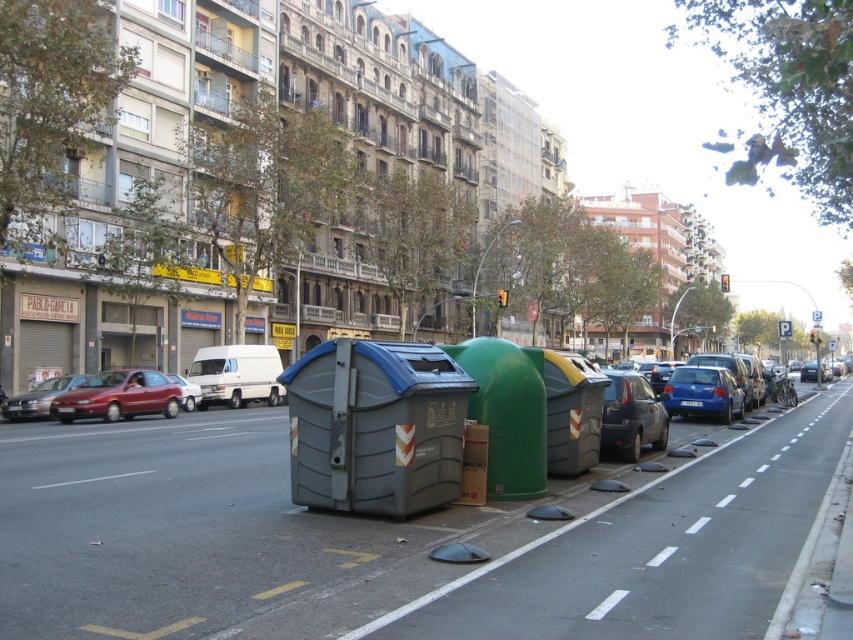
Question: Is white dashed lines at lower right wider than metallic red car at left?

Choices:
 (A) no
 (B) yes

Answer: (B)

Question: Among these points, which one is nearest to the camera?

Choices:
 (A) (187, 394)
 (B) (45, 413)
 (C) (741, 417)
 (D) (131, 392)

Answer: (D)

Question: Is white dashed lines at lower right below metallic red car at left?

Choices:
 (A) no
 (B) yes

Answer: (B)

Question: Considering the relative positions of metallic red car at left and matte silver car at center-left in the image provided, where is metallic red car at left located with respect to matte silver car at center-left?

Choices:
 (A) above
 (B) below

Answer: (B)

Question: Which object is the closest to the metallic red car at left?

Choices:
 (A) gray concrete curb at lower right
 (B) metallic blue sedan at right
 (C) shiny silver sedan at left
 (D) matte silver car at center-left

Answer: (C)

Question: Which point is farther to the camera?

Choices:
 (A) metallic red car at left
 (B) matte black car at center
 (C) metallic blue sedan at right
 (D) white dashed lines at lower right

Answer: (A)